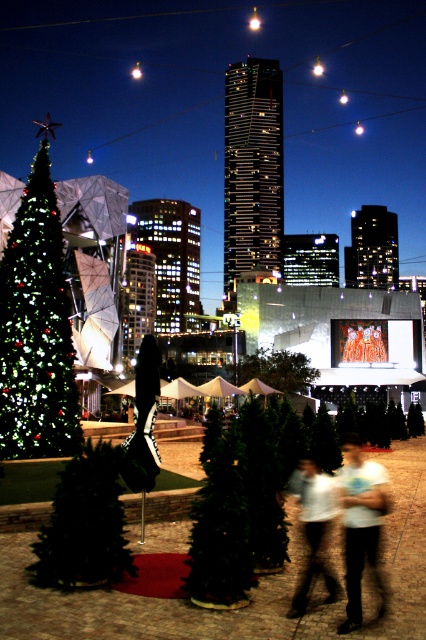
Between white cotton shirt at center and green matte tree at center, which one appears on the right side from the viewer's perspective?

Positioned to the right is white cotton shirt at center.

This screenshot has height=640, width=426. Identify the location of white cotton shirt at center. (313, 525).

Does white cotton t-shirt at center appear on the left side of green matte tree at center?

No, white cotton t-shirt at center is not to the left of green matte tree at center.

Is point (382, 496) closer to viewer compared to point (290, 372)?

That is True.

Which is in front, point (351, 467) or point (264, 376)?

Point (351, 467) is in front.

This screenshot has height=640, width=426. In order to click on white cotton t-shirt at center in this screenshot , I will do tap(360, 524).

Between point (229, 500) and point (371, 532), which one is positioned in front?

Point (371, 532)

How distant is green matte christmas tree at center from white cotton t-shirt at center?

They are 7.52 meters apart.

The image size is (426, 640). What are the coordinates of `green matte christmas tree at center` in the screenshot? It's located at (219, 524).

Where is `green matte christmas tree at center`? green matte christmas tree at center is located at coordinates (219, 524).